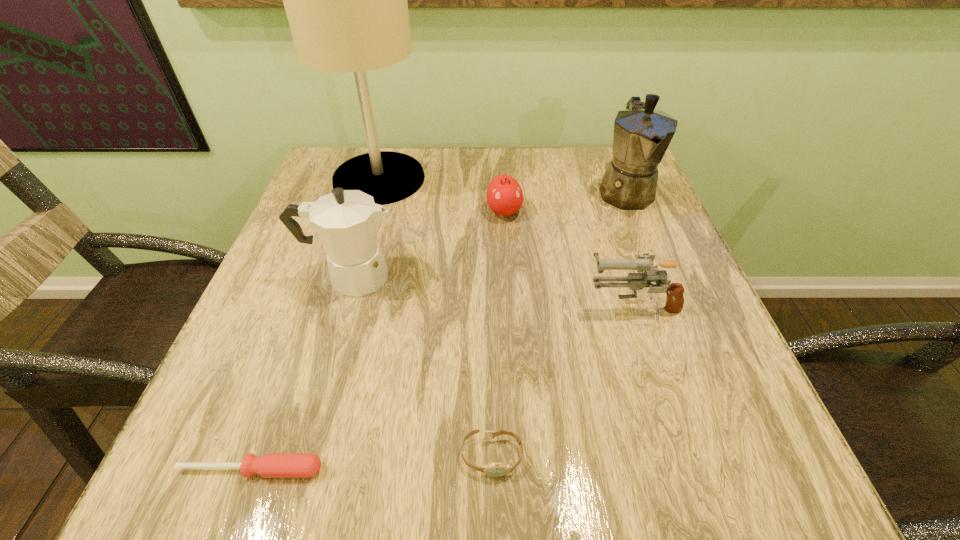
Locate an element on the screen. The width and height of the screenshot is (960, 540). vacant space situated 0.100m on the pouring side of the farther coffeepot is located at coordinates (647, 247).

You are a GUI agent. You are given a task and a screenshot of the screen. Output one action in this format:
    pyautogui.click(x=<x>, y=<y>)
    Task: Click on the vacant space positioned at the spout of the left coffeepot
    The image size is (960, 540).
    Given the screenshot: What is the action you would take?
    pyautogui.click(x=449, y=276)

The height and width of the screenshot is (540, 960). Find the location of `free space located at the barrel end of the gun`. free space located at the barrel end of the gun is located at coordinates (539, 303).

At what (x,y) coordinates should I click in order to perform the action: click on vacant space situated at the barrel end of the gun. Please return your answer as a coordinate pair (x, y). The width and height of the screenshot is (960, 540). Looking at the image, I should click on (469, 303).

Where is `vacant area situated 0.200m at the barrel end of the gun`? This screenshot has height=540, width=960. vacant area situated 0.200m at the barrel end of the gun is located at coordinates (480, 303).

Find the location of a particular element. This screenshot has width=960, height=540. free space located on the right of the apple is located at coordinates (573, 211).

Locate an element on the screen. The image size is (960, 540). free space located 0.080m on the back of the screwdriver is located at coordinates (274, 408).

I want to click on table lamp at the far edge, so click(x=346, y=2).

Locate an element on the screen. coffeepot that is at the far edge is located at coordinates (642, 135).

Locate an element on the screen. This screenshot has height=540, width=960. watch that is positioned at the near edge is located at coordinates (496, 469).